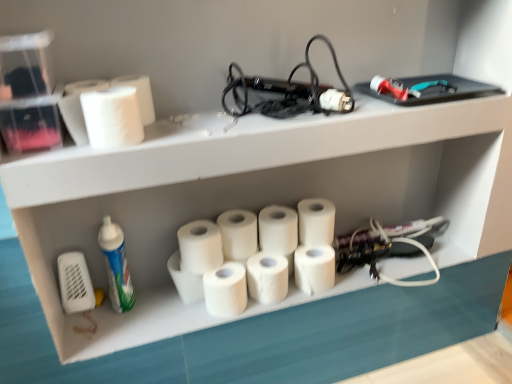
Locate an element on the screen. This screenshot has width=512, height=384. vacant region to the left of white matte paper towel at center, arranged as the sixth paper towel when viewed from the right is located at coordinates (156, 316).